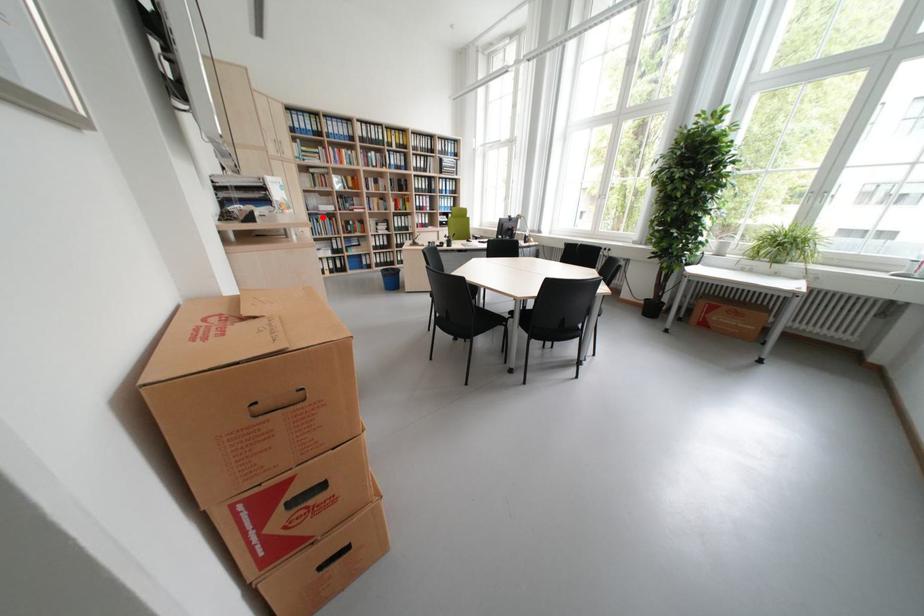
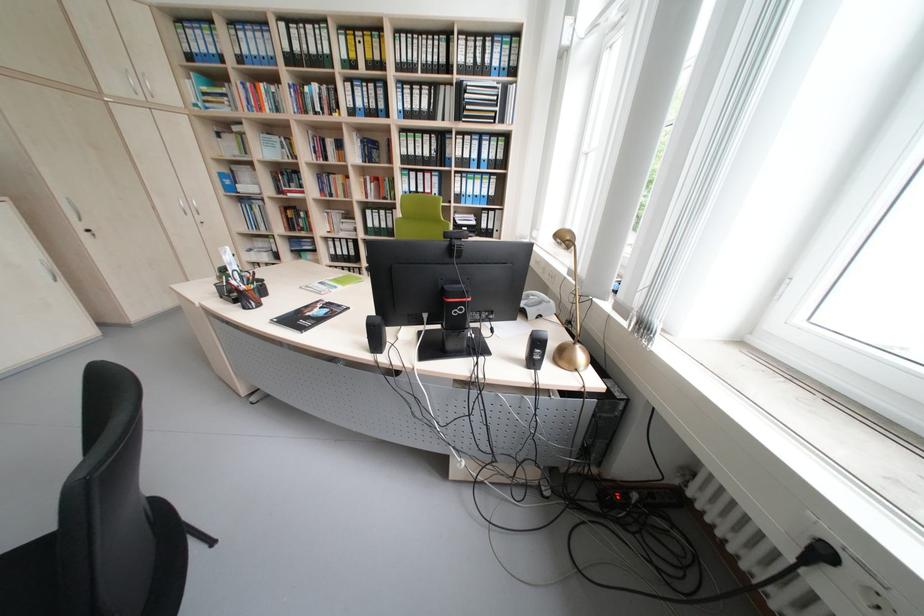
Question: I am providing you with two images of the same scene from different viewpoints. Image1 has a red point marked. In image2, the corresponding 3D location appears at what relative position? Reply with the corresponding letter.

Choices:
 (A) Closer
 (B) Farther

Answer: (B)